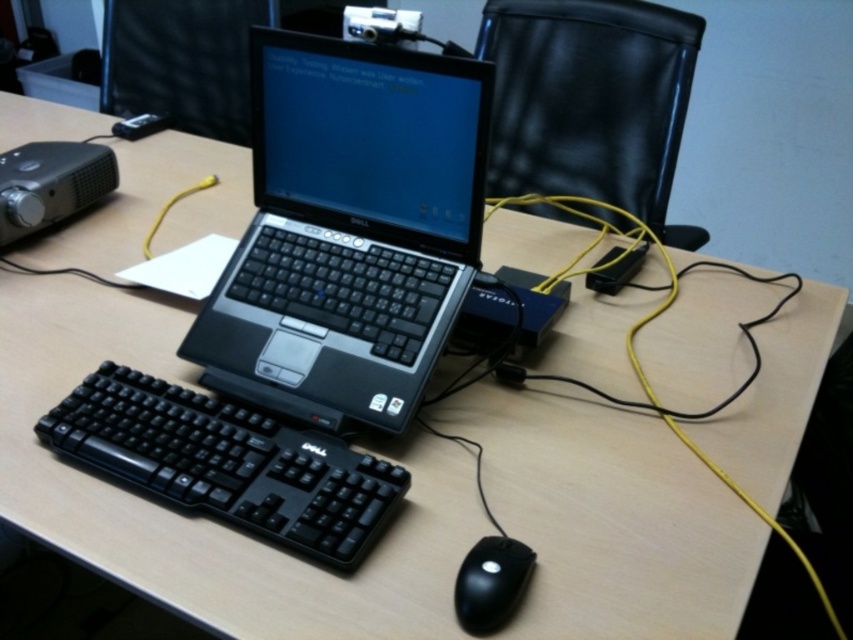
Question: Is black plastic projector at left to the left of black matte mouse at lower center from the viewer's perspective?

Choices:
 (A) no
 (B) yes

Answer: (B)

Question: Which point appears farthest from the camera in this image?

Choices:
 (A) (64, 180)
 (B) (538, 12)
 (C) (161, 444)
 (D) (465, 74)

Answer: (B)

Question: Which point appears closest to the camera in this image?

Choices:
 (A) (474, 611)
 (B) (80, 429)

Answer: (A)

Question: Where is black plastic keyboard at lower left located in relation to black plastic projector at left in the image?

Choices:
 (A) right
 (B) left

Answer: (A)

Question: Among these points, which one is farthest from the camera?

Choices:
 (A) coord(566,218)
 (B) coord(292,460)
 (C) coord(463,560)

Answer: (A)

Question: Does black plastic laptop at center lie in front of black leather chair at upper right?

Choices:
 (A) no
 (B) yes

Answer: (B)